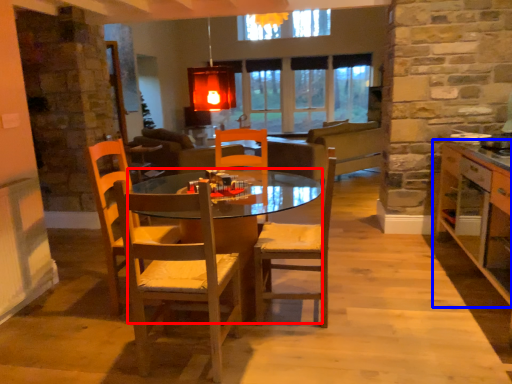
Question: Which object appears farthest to the camera in this image, desk (highlighted by a red box) or cabinetry (highlighted by a blue box)?

Choices:
 (A) desk
 (B) cabinetry

Answer: (A)